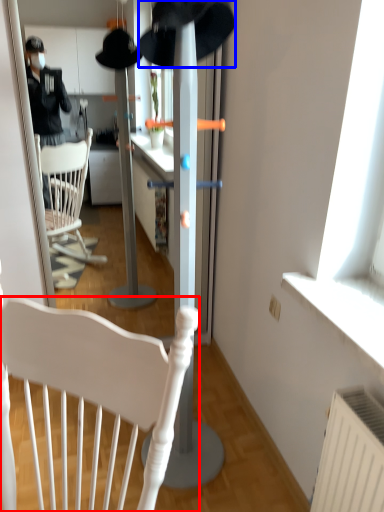
Question: Among these objects, which one is nearest to the camera, chair (highlighted by a red box) or hat (highlighted by a blue box)?

Choices:
 (A) chair
 (B) hat

Answer: (B)